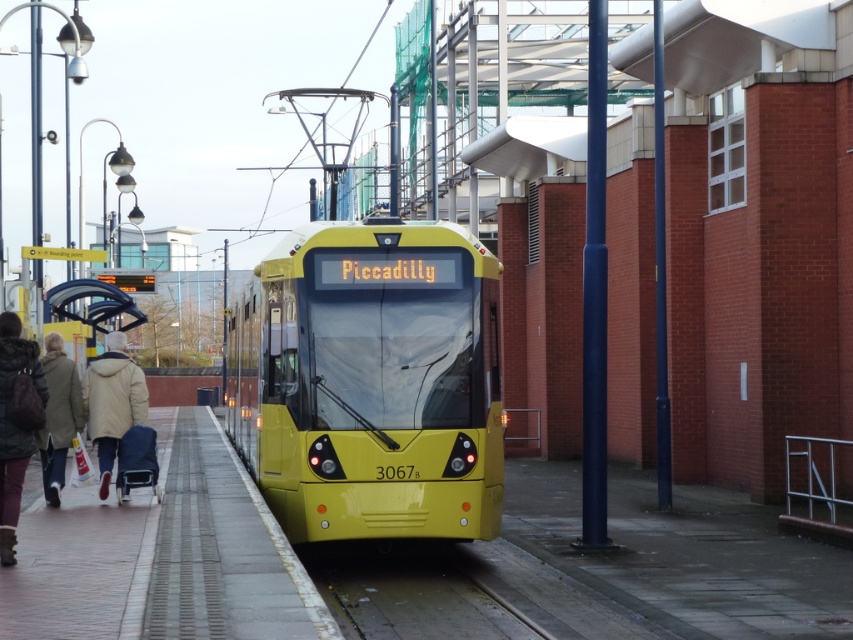
Question: Which point is closer to the camera taking this photo?

Choices:
 (A) (94, 618)
 (B) (436, 554)

Answer: (A)

Question: Which object is the closest to the light brown leather coat at lower left?

Choices:
 (A) yellow matte train at center
 (B) velvet brown coat at lower left
 (C) brick pavement at lower left
 (D) beige woolen coat at left

Answer: (D)

Question: Which point is closer to the camera?

Choices:
 (A) (141, 385)
 (B) (26, 438)
 (C) (199, 600)

Answer: (C)

Question: Is velvet brown coat at lower left closer to the viewer compared to light brown leather coat at lower left?

Choices:
 (A) yes
 (B) no

Answer: (A)

Question: Where is smooth concrete train track at center located in relation to light brown leather coat at lower left in the image?

Choices:
 (A) right
 (B) left

Answer: (A)

Question: Can you confirm if yellow matte train at center is positioned below light brown leather coat at lower left?

Choices:
 (A) no
 (B) yes

Answer: (B)